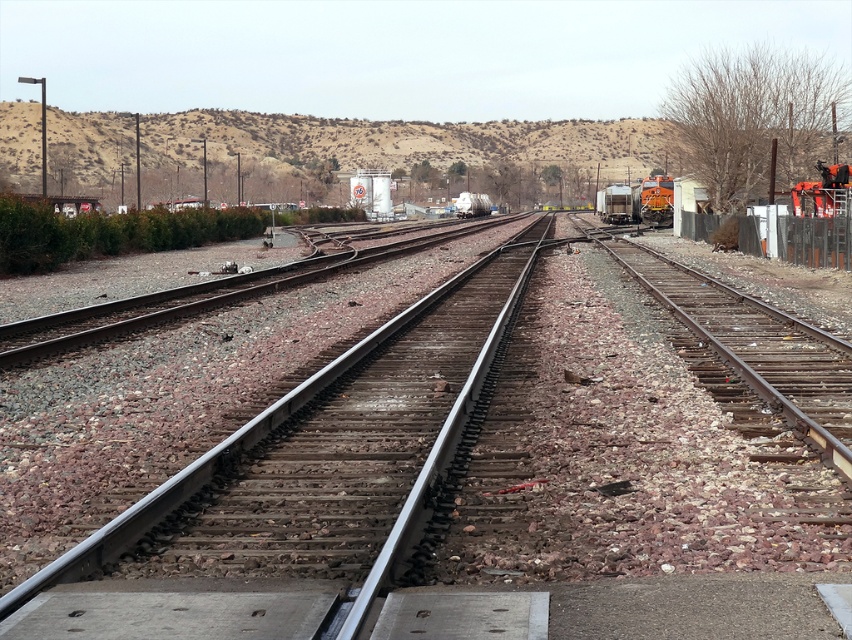
Between metal fence at right and orange metallic train at right, which one is positioned higher?

orange metallic train at right is above.

Who is shorter, metal fence at right or orange metallic train at right?

Standing shorter between the two is metal fence at right.

Where is `metal fence at right`? This screenshot has width=852, height=640. metal fence at right is located at coordinates (815, 241).

Between point (268, 516) and point (620, 188), which one is positioned behind?

Point (620, 188)

The image size is (852, 640). What do you see at coordinates (314, 456) in the screenshot?
I see `metal/smooth train track at center` at bounding box center [314, 456].

Where is `metal/smooth train track at center`? The image size is (852, 640). metal/smooth train track at center is located at coordinates click(314, 456).

Can you confirm if metal/smooth train track at center is positioned to the right of metal fence at right?

In fact, metal/smooth train track at center is to the left of metal fence at right.

Can you confirm if metal/smooth train track at center is smaller than metal fence at right?

No.

What do you see at coordinates (314, 456) in the screenshot? I see `metal/smooth train track at center` at bounding box center [314, 456].

Identify the location of metal/smooth train track at center. (314, 456).